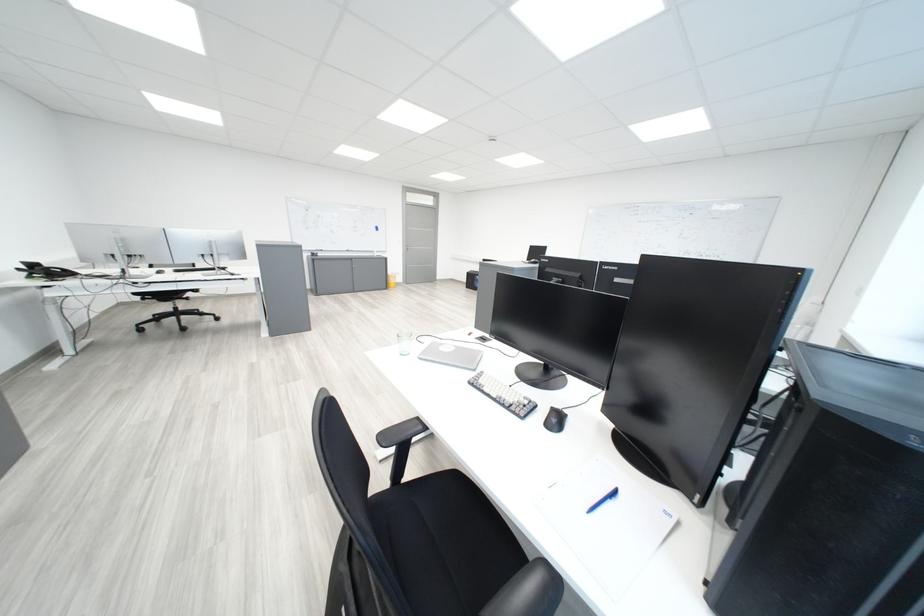
The location [602,500] corresponds to which object?

It corresponds to the blue pen in the image.